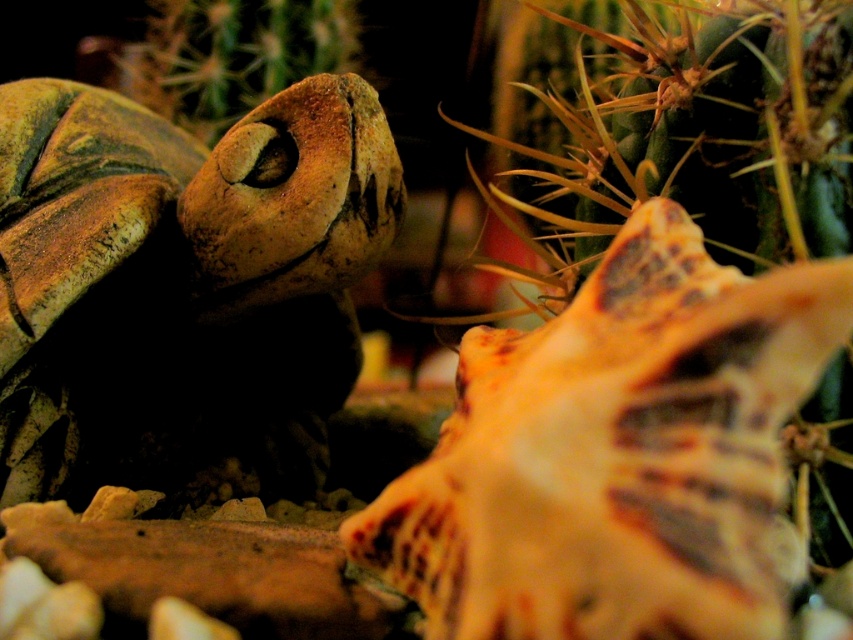
Based on the photo, how distant is matte brown tortoise at center from brown textured cactus at upper left?

33.89 inches

Which is in front, point (287, 349) or point (299, 16)?

Point (287, 349)

Locate an element on the screen. The height and width of the screenshot is (640, 853). matte brown tortoise at center is located at coordinates (183, 288).